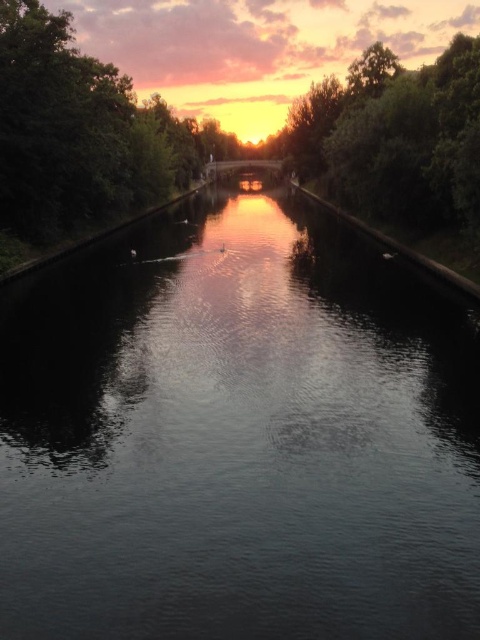
You are an artist planning to paint the canal scene. You want to ensure the dark reflective water at center and the green leafy tree at center are proportionally accurate. Which object should you make smaller in your painting?

The dark reflective water at center should be made smaller because it occupies less space than the green leafy tree at center according to the scene description.

You are planning to build a small wooden bridge over the canal. The bridge needs to span the distance between the dark reflective water at center and the green leafy tree at center. What is the minimum length of the bridge required to cover this distance?

The minimum length of the bridge required to cover the distance between the dark reflective water at center and the green leafy tree at center is 207.13 feet.